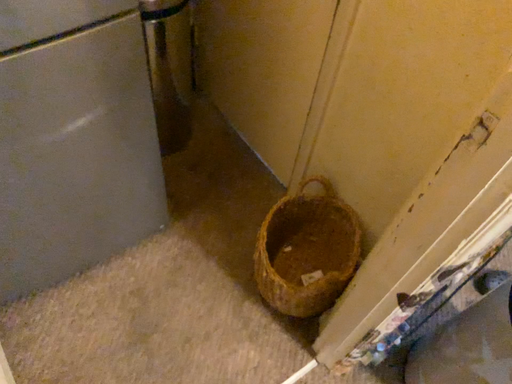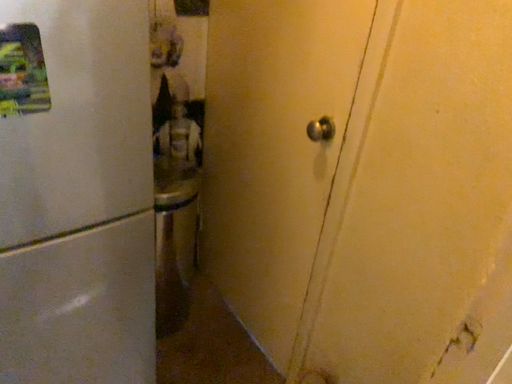
Question: Which way did the camera rotate in the video?

Choices:
 (A) rotated upward
 (B) rotated downward

Answer: (A)